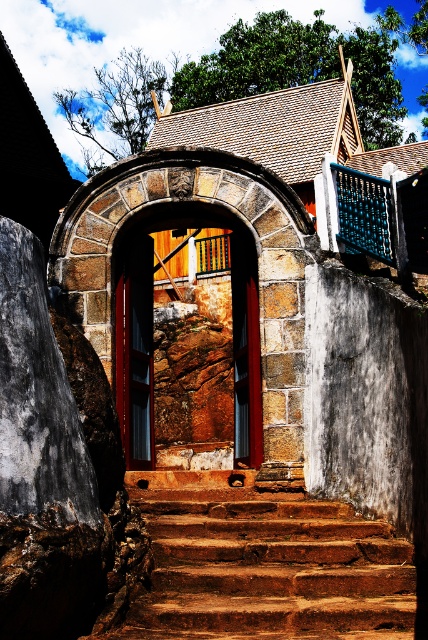
Describe the element at coordinates (262, 564) in the screenshot. I see `brown rustic stairs at center` at that location.

Can you confirm if brown rustic stairs at center is taller than matte wood door at center?

No, brown rustic stairs at center is not taller than matte wood door at center.

This screenshot has height=640, width=428. Describe the element at coordinates (262, 564) in the screenshot. I see `brown rustic stairs at center` at that location.

Where is `brown rustic stairs at center`? The width and height of the screenshot is (428, 640). brown rustic stairs at center is located at coordinates (262, 564).

Can you confirm if brown rustic stairs at center is smaller than rustic stone archway at center?

Yes.

The width and height of the screenshot is (428, 640). I want to click on brown rustic stairs at center, so click(x=262, y=564).

In order to click on brown rustic stairs at center in this screenshot , I will do `click(262, 564)`.

Between rustic stone archway at center and matte wood door at center, which one appears on the right side from the viewer's perspective?

rustic stone archway at center is more to the right.

Can you confirm if rustic stone archway at center is positioned to the right of matte wood door at center?

Correct, you'll find rustic stone archway at center to the right of matte wood door at center.

Which is in front, point (258, 440) or point (151, 444)?

Point (258, 440) is more forward.

Locate an element on the screen. This screenshot has width=428, height=640. rustic stone archway at center is located at coordinates (189, 349).